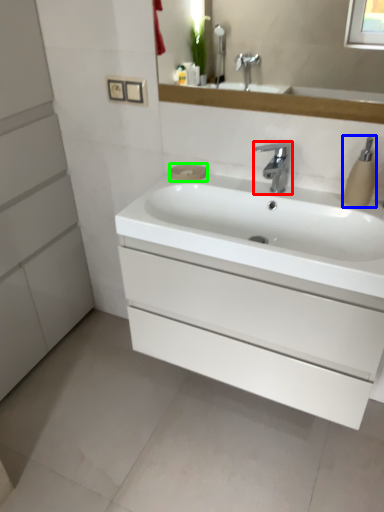
Question: Based on their relative distances, which object is nearer to tap (highlighted by a red box)? Choose from soap dispenser (highlighted by a blue box) and soap (highlighted by a green box).

Choices:
 (A) soap dispenser
 (B) soap

Answer: (A)